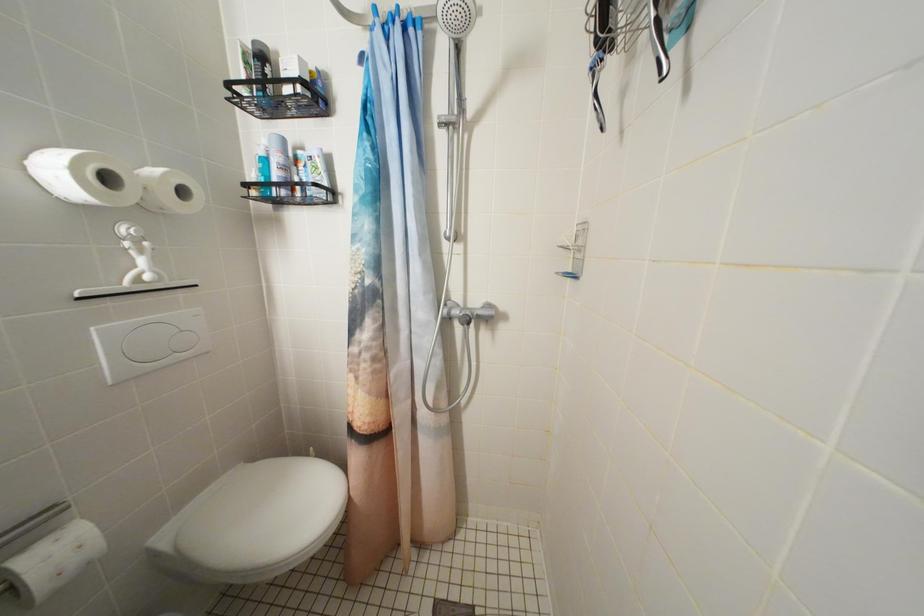
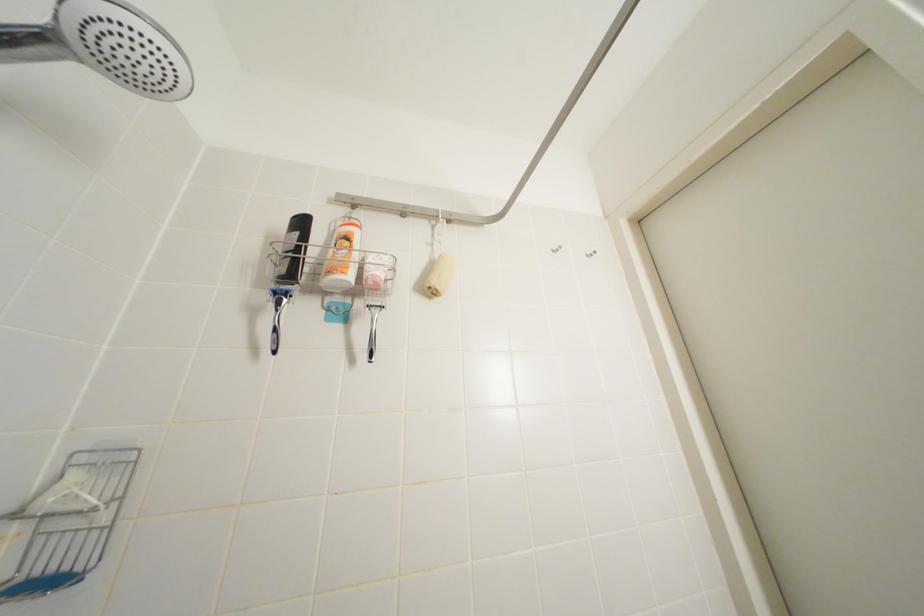
The images are taken continuously from a first-person perspective. In which direction is your viewpoint rotating?

The rotation direction of the camera is right-up.